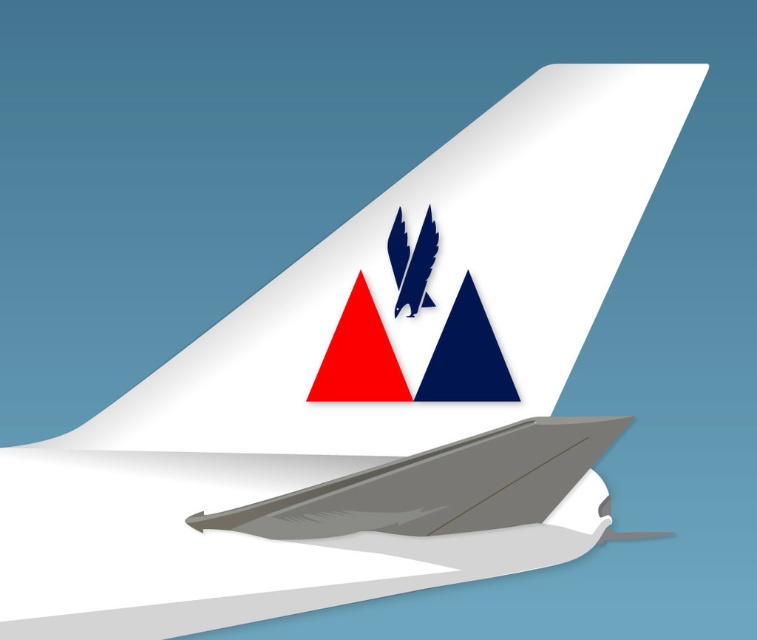
Does point (441, 520) come in front of point (365, 324)?

That is True.

Identify the location of matte gray winglet at lower center. This screenshot has height=640, width=757. (438, 486).

Between point (344, 518) and point (344, 396), which one is positioned behind?

Positioned behind is point (344, 396).

What are the coordinates of `matte gray winglet at lower center` in the screenshot? It's located at (438, 486).

Between matte gray winglet at lower center and blue glossy eagle at upper center, which one is positioned higher?

blue glossy eagle at upper center

Is matte gray winglet at lower center thinner than blue glossy eagle at upper center?

Incorrect, matte gray winglet at lower center's width is not less than blue glossy eagle at upper center's.

This screenshot has height=640, width=757. Identify the location of matte gray winglet at lower center. (438, 486).

Is navy blue matte triangle at upper center thinner than blue glossy eagle at upper center?

No, navy blue matte triangle at upper center is not thinner than blue glossy eagle at upper center.

Which of these two, navy blue matte triangle at upper center or blue glossy eagle at upper center, stands shorter?

blue glossy eagle at upper center

What are the coordinates of `navy blue matte triangle at upper center` in the screenshot? It's located at (466, 356).

Locate an element on the screen. navy blue matte triangle at upper center is located at coordinates (466, 356).